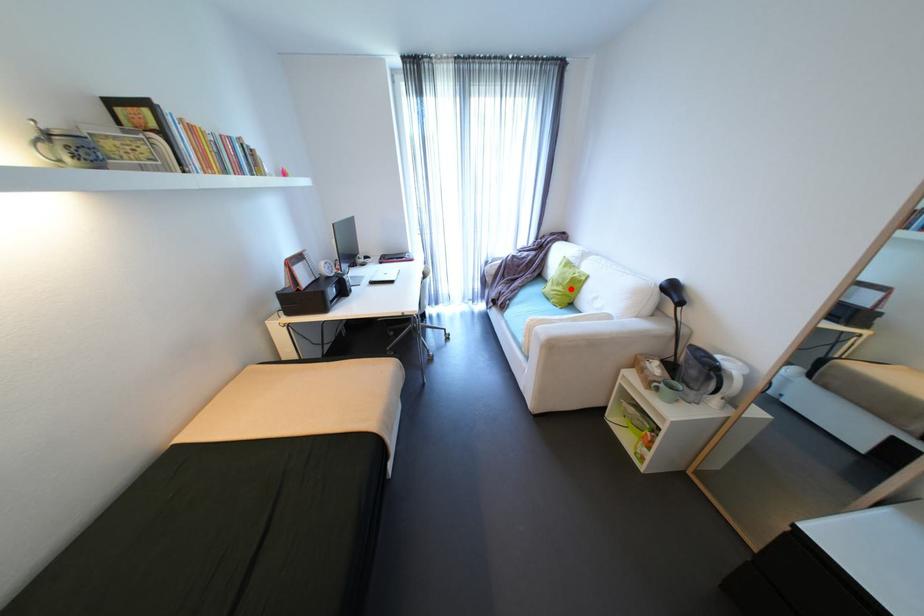
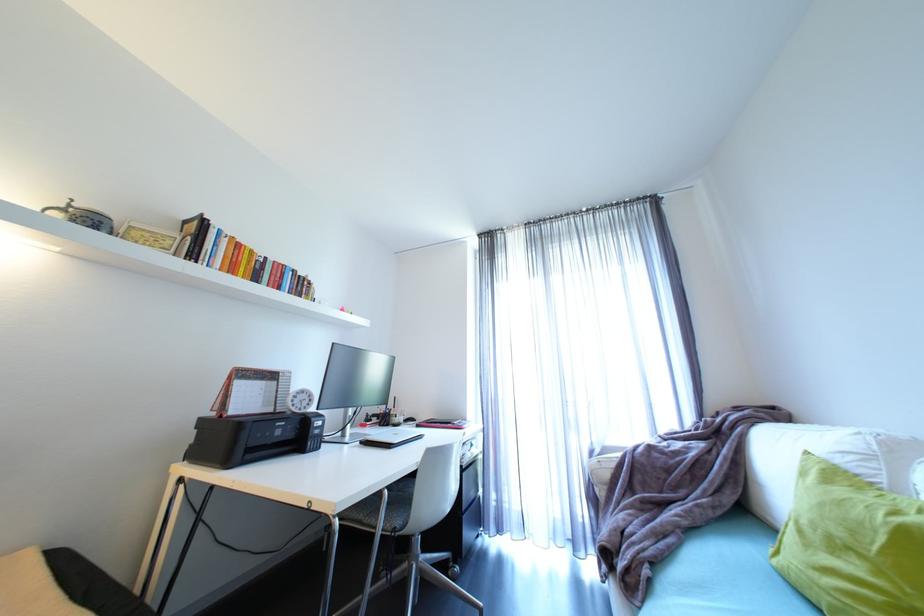
In the second image, find the point that corresponds to the highlighted location in the first image.

(885, 573)